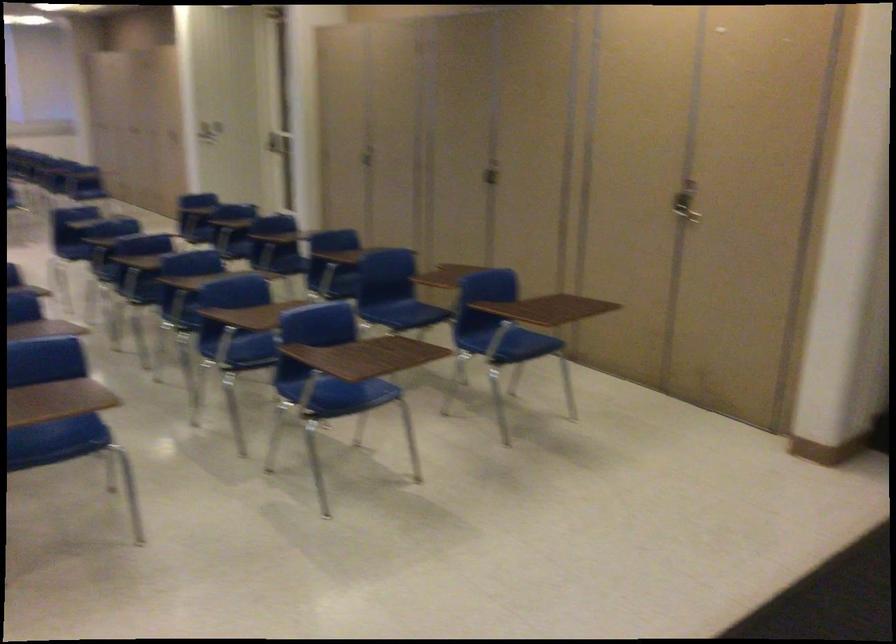
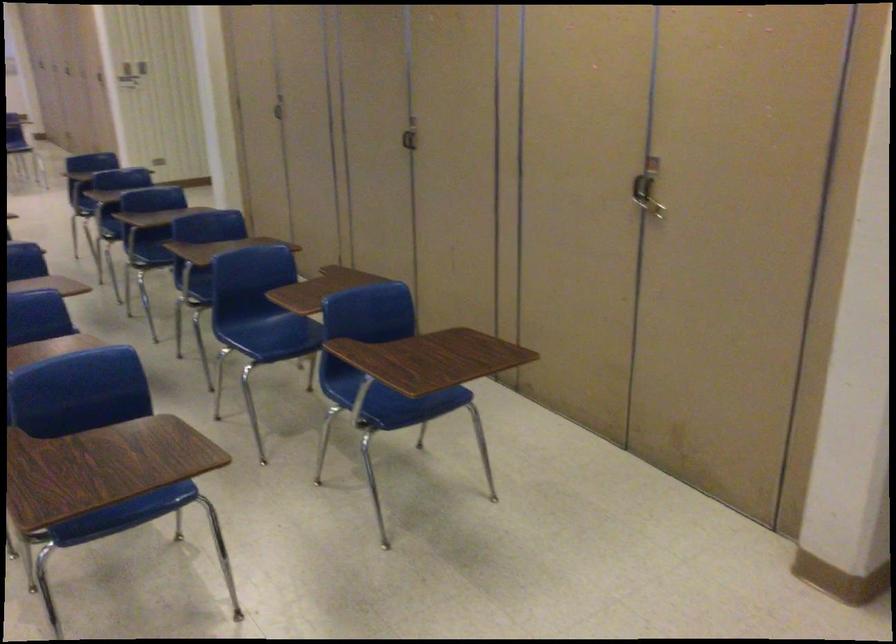
In the second image, find the point that corresponds to the point at 678,198 in the first image.

(647, 187)